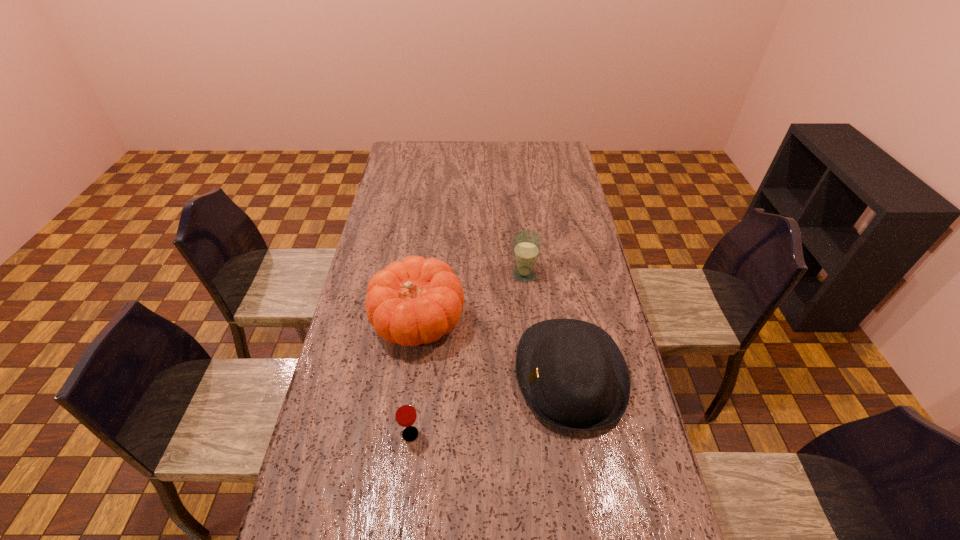
The image size is (960, 540). Identify the location of free space located on the front-facing side of the fedora. (481, 375).

Find the location of `vacant space situated 0.230m on the left of the shortest object`. vacant space situated 0.230m on the left of the shortest object is located at coordinates (313, 434).

Find the location of a particular element. Image resolution: width=960 pixels, height=540 pixels. object at the left edge is located at coordinates (417, 301).

Image resolution: width=960 pixels, height=540 pixels. In order to click on object present at the right edge in this screenshot , I will do `click(572, 374)`.

Find the location of a particular element. The height and width of the screenshot is (540, 960). vacant area at the far edge is located at coordinates (536, 165).

Identify the location of vacant area at the left edge of the desktop. The width and height of the screenshot is (960, 540). (400, 168).

The width and height of the screenshot is (960, 540). In the image, there is a desktop. Find the location of `vacant space at the right edge`. vacant space at the right edge is located at coordinates (586, 251).

The image size is (960, 540). What are the coordinates of `empty space between the shortest object and the farther glass` in the screenshot? It's located at (468, 354).

Where is `vacant space that is in between the nearer glass and the fedora`? This screenshot has width=960, height=540. vacant space that is in between the nearer glass and the fedora is located at coordinates (491, 404).

You are a GUI agent. You are given a task and a screenshot of the screen. Output one action in this format:
    pyautogui.click(x=<x>, y=<y>)
    Task: Click on the vacant region between the shorter glass and the right glass
    The width and height of the screenshot is (960, 540).
    Given the screenshot: What is the action you would take?
    pyautogui.click(x=468, y=354)